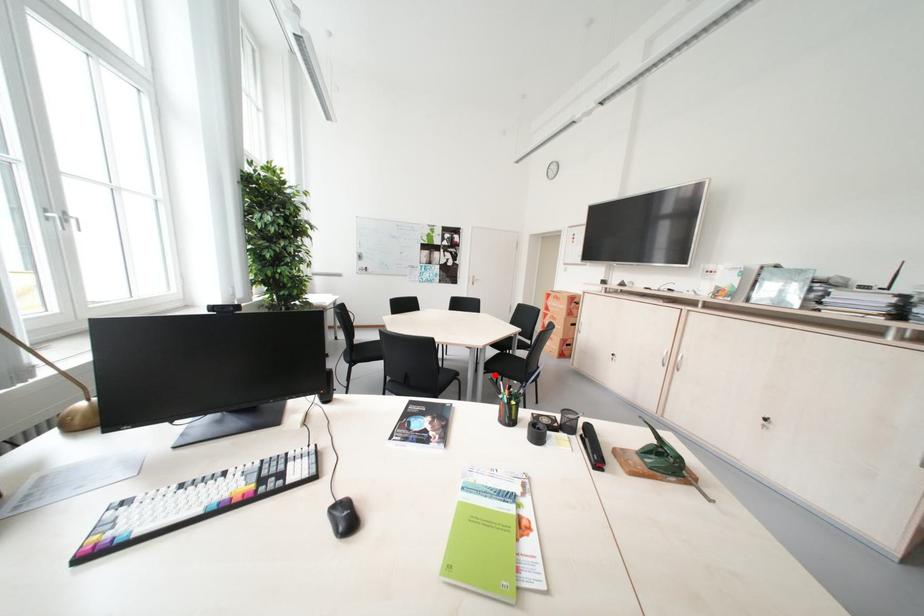
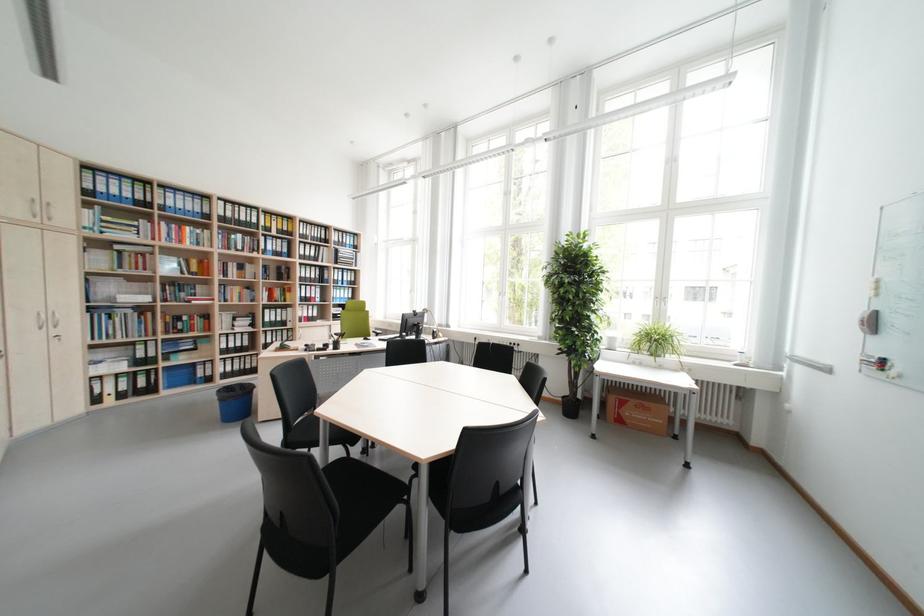
Question: I am providing you with two images of the same scene from different viewpoints. A red point is marked on the first image. Is the red point's position out of view in image 2?

Choices:
 (A) Yes
 (B) No

Answer: (A)